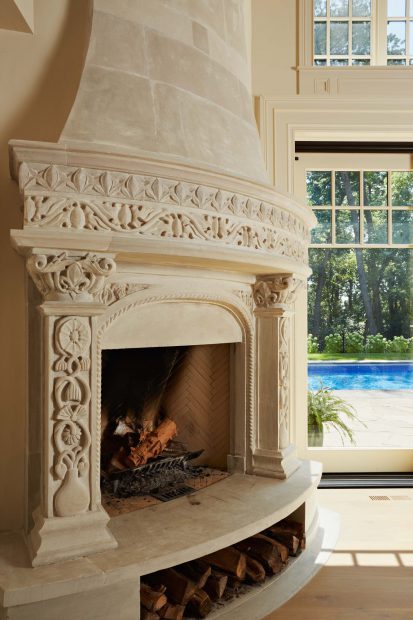
Identify the location of trim over fireplace. The height and width of the screenshot is (620, 413). (65, 190), (298, 228).